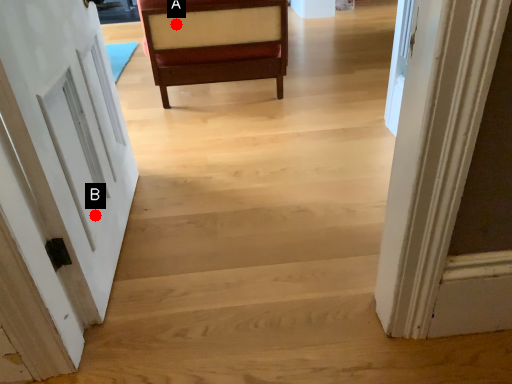
Question: Two points are circled on the image, labeled by A and B beside each circle. Which point is closer to the camera?

Choices:
 (A) A is closer
 (B) B is closer

Answer: (B)